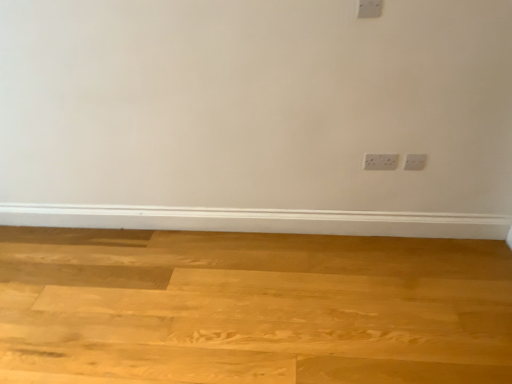
Question: Does point (419, 155) appear closer or farther from the camera than point (505, 279)?

Choices:
 (A) farther
 (B) closer

Answer: (A)

Question: Is white plastic power plugs and sockets at right inside or outside of natural wood plywood at lower center?

Choices:
 (A) inside
 (B) outside

Answer: (B)

Question: From the image's perspective, is white plastic power plugs and sockets at right above or below natural wood plywood at lower center?

Choices:
 (A) above
 (B) below

Answer: (A)

Question: In the image, is natural wood plywood at lower center positioned in front of or behind white plastic power plugs and sockets at right?

Choices:
 (A) front
 (B) behind

Answer: (A)

Question: In terms of size, does natural wood plywood at lower center appear bigger or smaller than white plastic power plugs and sockets at right?

Choices:
 (A) big
 (B) small

Answer: (A)

Question: Based on their positions, is natural wood plywood at lower center located to the left or right of white plastic power plugs and sockets at right?

Choices:
 (A) right
 (B) left

Answer: (B)

Question: Is natural wood plywood at lower center inside or outside of white plastic power plugs and sockets at right?

Choices:
 (A) outside
 (B) inside

Answer: (A)